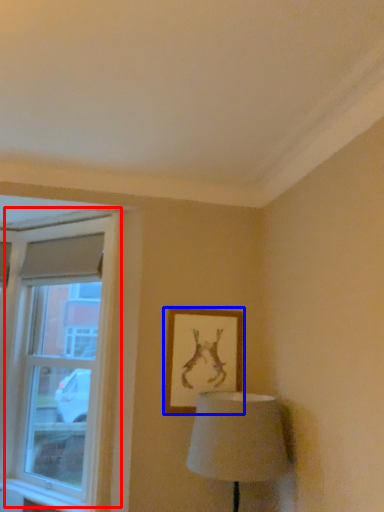
Question: Among these objects, which one is nearest to the camera, window (highlighted by a red box) or picture frame (highlighted by a blue box)?

Choices:
 (A) window
 (B) picture frame

Answer: (A)